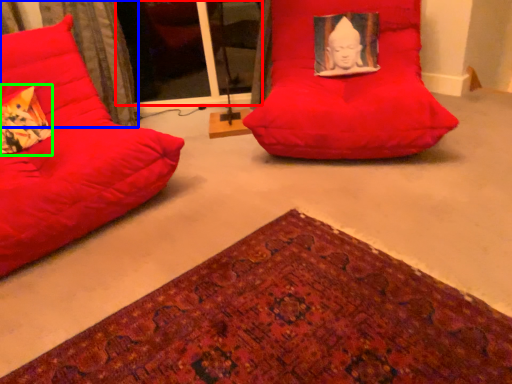
Question: Which object is the closest to the glass door (highlighted by a red box)? Choose among these: curtain (highlighted by a blue box) or throw pillow (highlighted by a green box).

Choices:
 (A) curtain
 (B) throw pillow

Answer: (A)